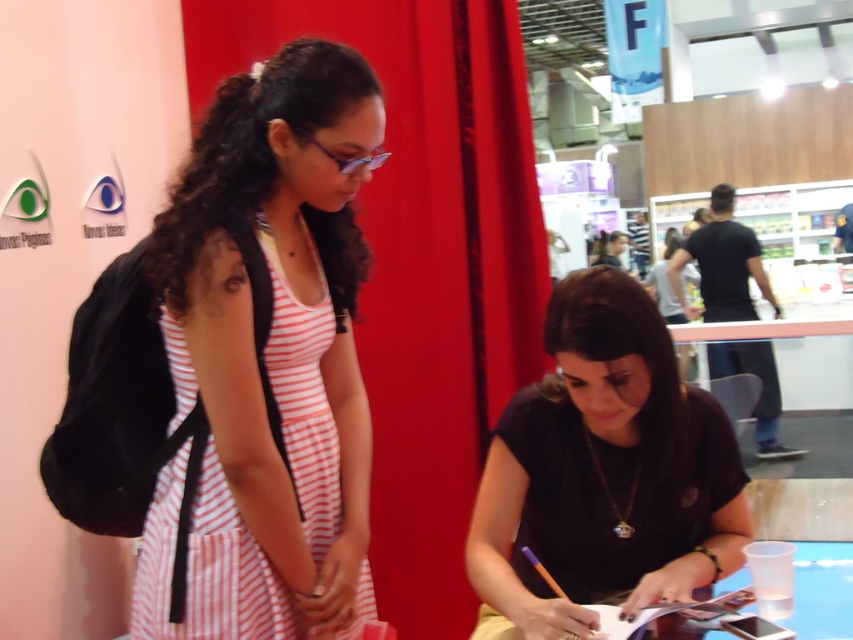
From the picture: You are organizing a charity event and need to arrange seating based on the sizes of the attendees. The attendees are wearing a pink striped dress at left and a black matte shirt at center. Which attendee requires a smaller chair size?

The pink striped dress at left requires a smaller chair size because it has a smaller size compared to the black matte shirt at center.

You are attending an event and notice two people in the foreground. The woman wearing the pink striped dress at left is standing while the other person in the black matte shirt at center is seated. Based on their positions, which clothing item is higher up in the image?

The pink striped dress at left is above the black matte shirt at center, so the pink striped dress at left is higher up in the image.